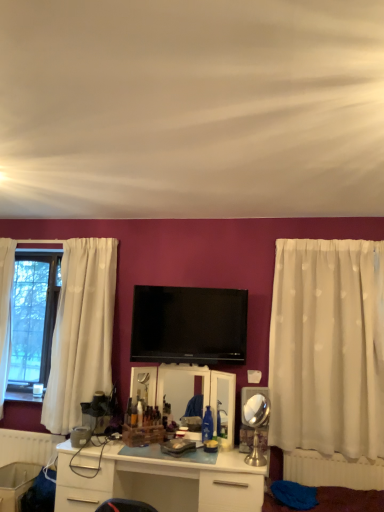
Question: Does white plastic radiator at lower left, the 1th radiator from the left, have a smaller size compared to flat screen tv at center?

Choices:
 (A) yes
 (B) no

Answer: (A)

Question: From a real-world perspective, does white plastic radiator at lower left, the 1th radiator from the left, stand above flat screen tv at center?

Choices:
 (A) yes
 (B) no

Answer: (B)

Question: Is the position of white plastic radiator at lower left, the 1th radiator from the left, less distant than that of flat screen tv at center?

Choices:
 (A) yes
 (B) no

Answer: (B)

Question: From a real-world perspective, is white plastic radiator at lower left, positioned as the second radiator in right-to-left order, positioned under flat screen tv at center based on gravity?

Choices:
 (A) yes
 (B) no

Answer: (A)

Question: Does white plastic radiator at lower left, positioned as the second radiator in right-to-left order, have a lesser height compared to flat screen tv at center?

Choices:
 (A) no
 (B) yes

Answer: (B)

Question: From the image's perspective, relative to white glossy desk at center, is white sheer curtain at right above or below?

Choices:
 (A) above
 (B) below

Answer: (A)

Question: In terms of width, does white sheer curtain at right look wider or thinner when compared to white glossy desk at center?

Choices:
 (A) wide
 (B) thin

Answer: (B)

Question: Visually, is white sheer curtain at right positioned to the left or to the right of white glossy desk at center?

Choices:
 (A) left
 (B) right

Answer: (B)

Question: Considering the positions of white sheer curtain at right and white glossy desk at center in the image, is white sheer curtain at right taller or shorter than white glossy desk at center?

Choices:
 (A) tall
 (B) short

Answer: (A)

Question: Looking at their shapes, would you say flat screen tv at center is wider or thinner than white sheer curtain at right?

Choices:
 (A) thin
 (B) wide

Answer: (A)

Question: From the image's perspective, is flat screen tv at center located above or below white sheer curtain at right?

Choices:
 (A) above
 (B) below

Answer: (A)

Question: Do you think flat screen tv at center is within white sheer curtain at right, or outside of it?

Choices:
 (A) outside
 (B) inside

Answer: (A)

Question: Is flat screen tv at center in front of or behind white sheer curtain at right in the image?

Choices:
 (A) front
 (B) behind

Answer: (B)

Question: Would you say flat screen tv at center is to the left or to the right of white plastic radiator at lower right, which is the second radiator from back to front, in the picture?

Choices:
 (A) left
 (B) right

Answer: (A)

Question: Considering the positions of flat screen tv at center and white plastic radiator at lower right, arranged as the first radiator when viewed from the right, in the image, is flat screen tv at center bigger or smaller than white plastic radiator at lower right, arranged as the first radiator when viewed from the right,?

Choices:
 (A) big
 (B) small

Answer: (A)